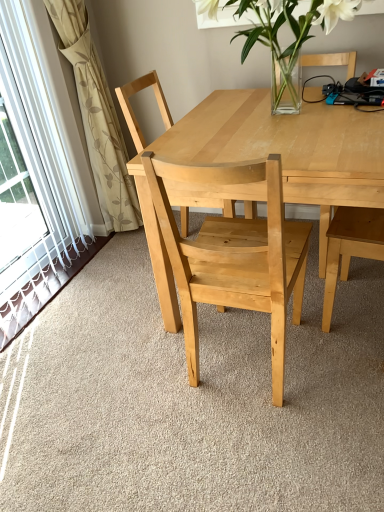
The height and width of the screenshot is (512, 384). Find the location of `vacant area that is in front of natural wood chair at center, the 1th chair viewed from the front`. vacant area that is in front of natural wood chair at center, the 1th chair viewed from the front is located at coordinates (269, 449).